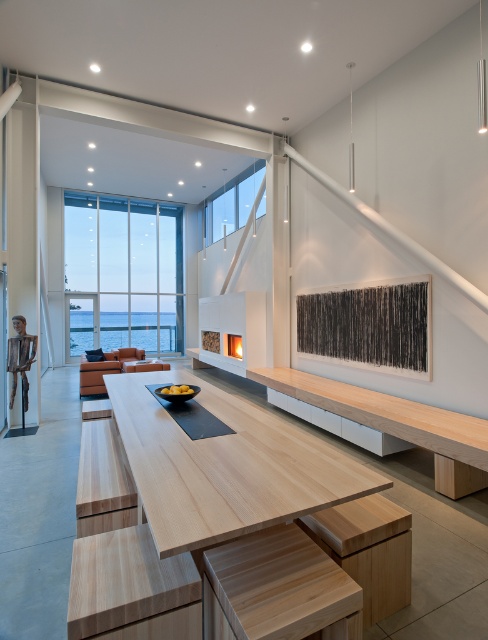
Question: Can you confirm if light brown wood stool at lower center is positioned above matte white fireplace at center?

Choices:
 (A) no
 (B) yes

Answer: (A)

Question: Which object is closer to the camera taking this photo?

Choices:
 (A) light brown wood stool at lower center
 (B) matte white fireplace at center
 (C) light wood table at center

Answer: (C)

Question: Is light wood table at center below light brown wood stool at lower center?

Choices:
 (A) yes
 (B) no

Answer: (B)

Question: Which point is farther from the camera taking this photo?

Choices:
 (A) (347, 522)
 (B) (228, 339)

Answer: (B)

Question: In this image, where is light wood table at center located relative to matte white fireplace at center?

Choices:
 (A) left
 (B) right

Answer: (A)

Question: Which of the following is the closest to the observer?

Choices:
 (A) (386, 500)
 (B) (237, 340)
 (C) (228, 460)

Answer: (C)